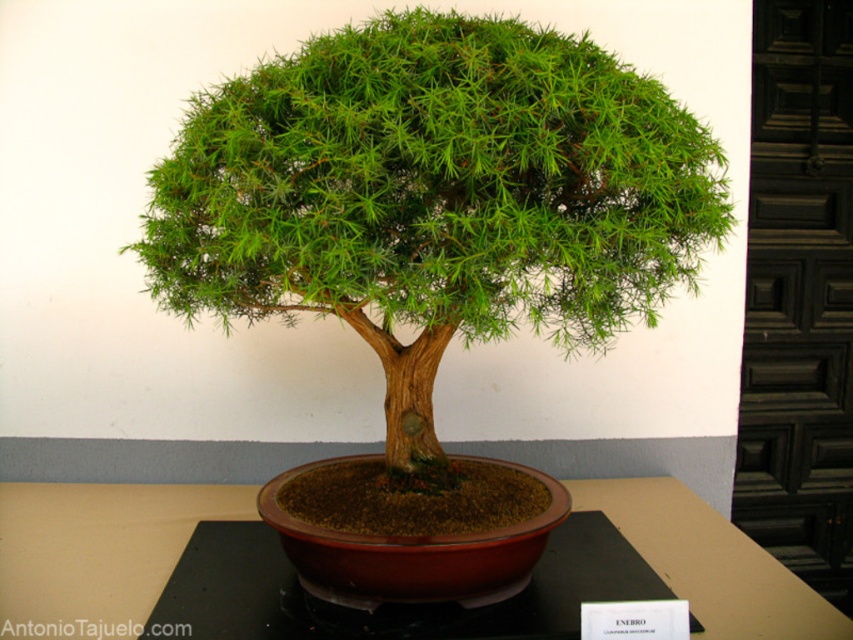
You are a gardener who wants to place a new small statue on the brown wooden table at center. The statue is 10 cm tall. Considering the green textured bonsai tree at center is much taller than the table, will the statue be visible from above the table?

The green textured bonsai tree at center is much taller than the brown wooden table at center, so the statue placed on the table may be partially or fully obscured by the tree depending on its placement. To ensure visibility, position the statue away from the tree or adjust the tree branches.

You are a bonsai enthusiast who wants to move the bonsai tree to a new location. You need to know if the green textured bonsai tree at center is currently resting on the brown wooden table at center. Can you confirm?

The green textured bonsai tree at center is positioned over brown wooden table at center, so yes, it is resting on the brown wooden table at center.